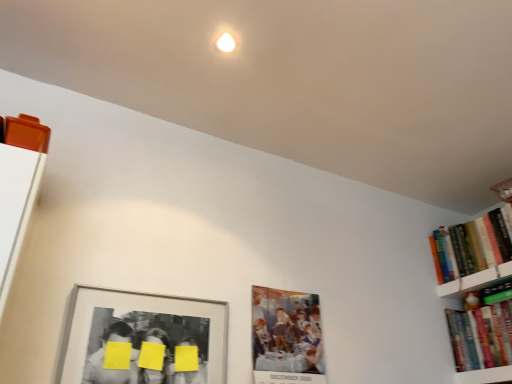
What do you see at coordinates (470, 247) in the screenshot? I see `hardcover books at right, which is counted as the 1th book, starting from the top` at bounding box center [470, 247].

You are a GUI agent. You are given a task and a screenshot of the screen. Output one action in this format:
    pyautogui.click(x=<x>, y=<y>)
    Task: Click on the matte silver picture frame at lower left, the first picture frame positioned from the left
    This screenshot has height=384, width=512.
    Given the screenshot: What is the action you would take?
    pyautogui.click(x=142, y=339)

What are the coordinates of `matte paper picture frame at center, which is counted as the first picture frame, starting from the right` in the screenshot? It's located at (286, 337).

From a real-world perspective, which is physically below, white glossy bookshelf at upper right or yellow matte paper at center?

yellow matte paper at center, from a real-world perspective.

Is white glossy bookshelf at upper right completely or partially outside of yellow matte paper at center?

Yes, white glossy bookshelf at upper right is not within yellow matte paper at center.

Is white glossy bookshelf at upper right wider or thinner than yellow matte paper at center?

Clearly, white glossy bookshelf at upper right has more width compared to yellow matte paper at center.

Is white glossy bookshelf at upper right not near yellow matte paper at center?

Yes, white glossy bookshelf at upper right and yellow matte paper at center are quite far apart.

From a real-world perspective, is matte silver picture frame at lower left, placed as the second picture frame when sorted from right to left, physically above white glossy bookshelf at upper right?

No, from a real-world perspective, matte silver picture frame at lower left, placed as the second picture frame when sorted from right to left, is not on top of white glossy bookshelf at upper right.

Is matte silver picture frame at lower left, placed as the second picture frame when sorted from right to left, not close to white glossy bookshelf at upper right?

Absolutely, matte silver picture frame at lower left, placed as the second picture frame when sorted from right to left, is distant from white glossy bookshelf at upper right.

Is matte silver picture frame at lower left, placed as the second picture frame when sorted from right to left, oriented away from white glossy bookshelf at upper right?

No, matte silver picture frame at lower left, placed as the second picture frame when sorted from right to left, is not facing away from white glossy bookshelf at upper right.

Considering the relative sizes of matte paper picture frame at center, which is counted as the first picture frame, starting from the right, and hardcover book at right, the second book from the top, in the image provided, is matte paper picture frame at center, which is counted as the first picture frame, starting from the right, shorter than hardcover book at right, the second book from the top,?

In fact, matte paper picture frame at center, which is counted as the first picture frame, starting from the right, may be taller than hardcover book at right, the second book from the top.

Find the location of a particular element. The width and height of the screenshot is (512, 384). book below the matte paper picture frame at center, which is counted as the first picture frame, starting from the right (from the image's perspective) is located at coordinates tap(482, 329).

From a real-world perspective, is matte paper picture frame at center, which is counted as the second picture frame, starting from the left, over hardcover book at right, the second book from the top?

No, from a real-world perspective, matte paper picture frame at center, which is counted as the second picture frame, starting from the left, is not on top of hardcover book at right, the second book from the top.

Does matte paper picture frame at center, which is counted as the second picture frame, starting from the left, lie in front of hardcover book at right, which ranks as the 1th book in bottom-to-top order?

That is True.

The height and width of the screenshot is (384, 512). There is a hardcover book at right, the second book from the top. Identify the location of the 2nd picture frame above it (from the image's perspective). (x=142, y=339).

From a real-world perspective, relative to matte silver picture frame at lower left, placed as the second picture frame when sorted from right to left, is hardcover book at right, which ranks as the 1th book in bottom-to-top order, vertically above or below?

Clearly, from a real-world perspective, hardcover book at right, which ranks as the 1th book in bottom-to-top order, is above matte silver picture frame at lower left, placed as the second picture frame when sorted from right to left.

Considering the relative positions of hardcover book at right, the second book from the top, and matte silver picture frame at lower left, the first picture frame positioned from the left, in the image provided, is hardcover book at right, the second book from the top, behind matte silver picture frame at lower left, the first picture frame positioned from the left,?

Yes, hardcover book at right, the second book from the top, is further from the camera.

Who is bigger, hardcover book at right, the second book from the top, or matte silver picture frame at lower left, placed as the second picture frame when sorted from right to left?

hardcover book at right, the second book from the top.

From the image's perspective, is hardcover book at right, which ranks as the 1th book in bottom-to-top order, positioned above or below yellow matte paper at center?

hardcover book at right, which ranks as the 1th book in bottom-to-top order, is situated lower than yellow matte paper at center in the image.

Which object is closer to the camera taking this photo, hardcover book at right, which ranks as the 1th book in bottom-to-top order, or yellow matte paper at center?

yellow matte paper at center is more forward.

Is hardcover book at right, the second book from the top, turned away from yellow matte paper at center?

No, hardcover book at right, the second book from the top, is not facing away from yellow matte paper at center.

Is hardcover book at right, which ranks as the 1th book in bottom-to-top order, to the left or to the right of yellow matte paper at center in the image?

Based on their positions, hardcover book at right, which ranks as the 1th book in bottom-to-top order, is located to the right of yellow matte paper at center.

Looking at this image, measure the distance from matte silver picture frame at lower left, placed as the second picture frame when sorted from right to left, to matte paper picture frame at center, which is counted as the second picture frame, starting from the left.

matte silver picture frame at lower left, placed as the second picture frame when sorted from right to left, and matte paper picture frame at center, which is counted as the second picture frame, starting from the left, are 33.07 centimeters apart.

From a real-world perspective, is matte silver picture frame at lower left, the first picture frame positioned from the left, above or below matte paper picture frame at center, which is counted as the second picture frame, starting from the left?

From a real-world perspective, matte silver picture frame at lower left, the first picture frame positioned from the left, is physically below matte paper picture frame at center, which is counted as the second picture frame, starting from the left.

Is matte paper picture frame at center, which is counted as the second picture frame, starting from the left, inside matte silver picture frame at lower left, the first picture frame positioned from the left?

Actually, matte paper picture frame at center, which is counted as the second picture frame, starting from the left, is outside matte silver picture frame at lower left, the first picture frame positioned from the left.

Which of these two, matte paper picture frame at center, which is counted as the second picture frame, starting from the left, or white glossy bookshelf at upper right, is bigger?

With larger size is matte paper picture frame at center, which is counted as the second picture frame, starting from the left.

Considering the relative positions of matte paper picture frame at center, which is counted as the first picture frame, starting from the right, and white glossy bookshelf at upper right in the image provided, is matte paper picture frame at center, which is counted as the first picture frame, starting from the right, to the left or to the right of white glossy bookshelf at upper right?

Based on their positions, matte paper picture frame at center, which is counted as the first picture frame, starting from the right, is located to the left of white glossy bookshelf at upper right.

Is white glossy bookshelf at upper right inside matte paper picture frame at center, which is counted as the first picture frame, starting from the right?

That's incorrect, white glossy bookshelf at upper right is not inside matte paper picture frame at center, which is counted as the first picture frame, starting from the right.

Starting from the white glossy bookshelf at upper right, which picture frame is the 1st one to the left? Please provide its 2D coordinates.

[(286, 337)]

The image size is (512, 384). In order to click on person on the left side of white glossy bookshelf at upper right in this screenshot , I will do [188, 363].

Locate an element on the screen. The width and height of the screenshot is (512, 384). shelf lying on the right of matte silver picture frame at lower left, placed as the second picture frame when sorted from right to left is located at coordinates (476, 280).

Looking at this image, based on their spatial positions, is white glossy bookshelf at upper right or matte paper picture frame at center, which is counted as the first picture frame, starting from the right, further from matte silver picture frame at lower left, the first picture frame positioned from the left?

white glossy bookshelf at upper right is further to matte silver picture frame at lower left, the first picture frame positioned from the left.

Considering their positions, is matte silver picture frame at lower left, placed as the second picture frame when sorted from right to left, positioned further to yellow matte paper at center than hardcover book at right, the second book from the top?

Among the two, hardcover book at right, the second book from the top, is located further to yellow matte paper at center.

Consider the image. Considering their positions, is matte silver picture frame at lower left, the first picture frame positioned from the left, positioned closer to white glossy bookshelf at upper right than yellow matte paper at center?

Among the two, yellow matte paper at center is located nearer to white glossy bookshelf at upper right.

Estimate the real-world distances between objects in this image. Which object is further from white glossy bookshelf at upper right, hardcover books at right, which is counted as the 1th book, starting from the top, or yellow matte paper at center?

yellow matte paper at center.

Which object lies further to the anchor point matte silver picture frame at lower left, the first picture frame positioned from the left, matte paper picture frame at center, which is counted as the first picture frame, starting from the right, or white glossy bookshelf at upper right?

Among the two, white glossy bookshelf at upper right is located further to matte silver picture frame at lower left, the first picture frame positioned from the left.

Looking at the image, which one is located closer to white glossy bookshelf at upper right, matte paper picture frame at center, which is counted as the second picture frame, starting from the left, or matte silver picture frame at lower left, placed as the second picture frame when sorted from right to left?

Among the two, matte paper picture frame at center, which is counted as the second picture frame, starting from the left, is located nearer to white glossy bookshelf at upper right.

Considering their positions, is hardcover books at right, which is counted as the 1th book, starting from the top, positioned further to white glossy bookshelf at upper right than hardcover book at right, the second book from the top?

hardcover book at right, the second book from the top, lies further to white glossy bookshelf at upper right than the other object.

Looking at the image, which one is located closer to yellow matte paper at center, hardcover book at right, which ranks as the 1th book in bottom-to-top order, or white glossy bookshelf at upper right?

hardcover book at right, which ranks as the 1th book in bottom-to-top order, lies closer to yellow matte paper at center than the other object.

Where is `person situated between matte silver picture frame at lower left, the first picture frame positioned from the left, and matte paper picture frame at center, which is counted as the first picture frame, starting from the right, from left to right`? Image resolution: width=512 pixels, height=384 pixels. person situated between matte silver picture frame at lower left, the first picture frame positioned from the left, and matte paper picture frame at center, which is counted as the first picture frame, starting from the right, from left to right is located at coordinates (188, 363).

Identify the location of book between matte silver picture frame at lower left, the first picture frame positioned from the left, and hardcover books at right, which is counted as the 1th book, starting from the top, from left to right. The width and height of the screenshot is (512, 384). (482, 329).

Find the location of a particular element. The width and height of the screenshot is (512, 384). person between matte silver picture frame at lower left, the first picture frame positioned from the left, and hardcover book at right, the second book from the top, from left to right is located at coordinates (188, 363).

Identify the location of picture frame situated between matte silver picture frame at lower left, the first picture frame positioned from the left, and hardcover book at right, the second book from the top, from left to right. The width and height of the screenshot is (512, 384). (286, 337).